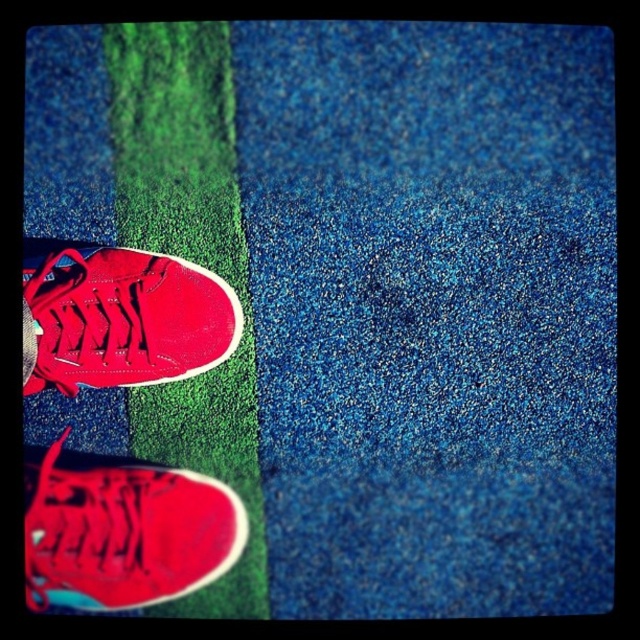
Question: Which object is closer to the camera taking this photo?

Choices:
 (A) shiny red sneaker at center
 (B) shiny red sneaker at lower left

Answer: (A)

Question: Can you confirm if shiny red sneaker at lower left is wider than shiny red sneaker at center?

Choices:
 (A) no
 (B) yes

Answer: (B)

Question: Which object appears closest to the camera in this image?

Choices:
 (A) shiny red sneaker at lower left
 (B) shiny red sneaker at center

Answer: (B)

Question: Does shiny red sneaker at lower left have a larger size compared to shiny red sneaker at center?

Choices:
 (A) no
 (B) yes

Answer: (A)

Question: Can you confirm if shiny red sneaker at lower left is thinner than shiny red sneaker at center?

Choices:
 (A) no
 (B) yes

Answer: (A)